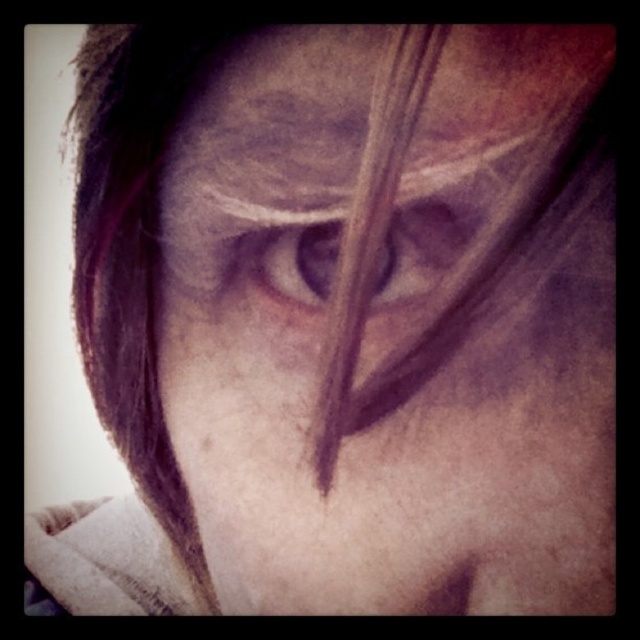
Question: Among these objects, which one is farthest from the camera?

Choices:
 (A) matte skin eye at center
 (B) brown matte eye at center
 (C) matte skin at center

Answer: (A)

Question: Considering the relative positions of matte skin at center and matte skin eye at center in the image provided, where is matte skin at center located with respect to matte skin eye at center?

Choices:
 (A) left
 (B) right

Answer: (B)

Question: Considering the real-world distances, which object is farthest from the matte skin eye at center?

Choices:
 (A) matte skin at center
 (B) brown matte eye at center

Answer: (A)

Question: Does matte skin at center appear over brown matte eye at center?

Choices:
 (A) yes
 (B) no

Answer: (A)

Question: Which of the following is the closest to the observer?

Choices:
 (A) matte skin eye at center
 (B) brown matte eye at center
 (C) matte skin at center

Answer: (C)

Question: Does matte skin at center have a greater width compared to matte skin eye at center?

Choices:
 (A) no
 (B) yes

Answer: (B)